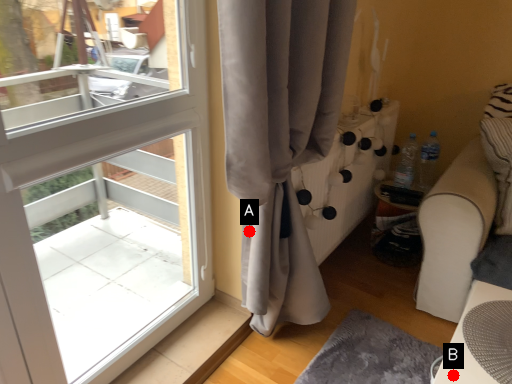
Question: Two points are circled on the image, labeled by A and B beside each circle. Which point is further to the camera?

Choices:
 (A) A is further
 (B) B is further

Answer: (A)